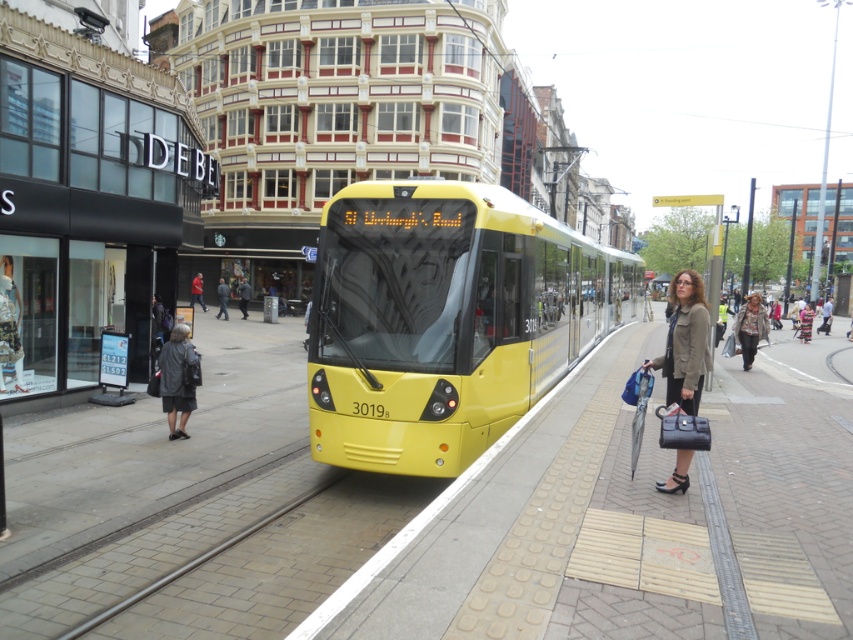
Question: Is leather jacket at center above dark gray jacket at center?

Choices:
 (A) no
 (B) yes

Answer: (A)

Question: Which object is closer to the camera taking this photo?

Choices:
 (A) matte brown jacket at right
 (B) dark gray jacket at center
 (C) yellow matte bus at center

Answer: (A)

Question: Is yellow matte bus at center behind leather jacket at center?

Choices:
 (A) no
 (B) yes

Answer: (A)

Question: Based on their relative distances, which object is nearer to the red leather jacket at center?

Choices:
 (A) dark blue jacket at center
 (B) dark gray jacket at left
 (C) leather jacket at center
 (D) yellow matte bus at center

Answer: (A)

Question: Where is dark blue jacket at center located in relation to dark gray jacket at center in the image?

Choices:
 (A) above
 (B) below

Answer: (A)

Question: Which object appears farthest from the camera in this image?

Choices:
 (A) dark gray jacket at center
 (B) leather jacket at center
 (C) matte brown jacket at right

Answer: (A)